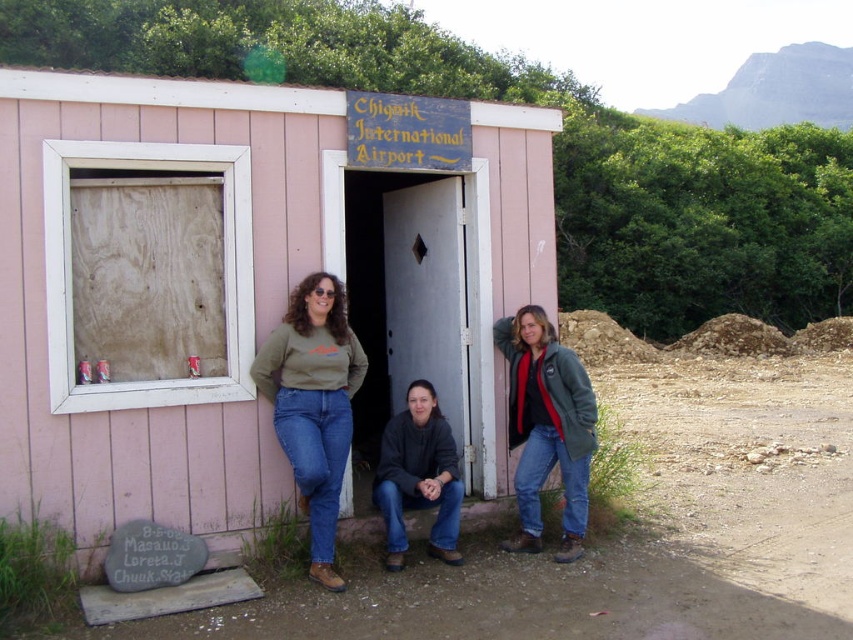
You are a photographer trying to capture a group photo of the matte green sweater at center and the green fleece jacket at right. Since you want them to be side by side, which one should you place on the left to match their current positions?

The matte green sweater at center should be placed on the left side of the green fleece jacket at right to match their current positions, as the matte green sweater at center is positioned on the left side of green fleece jacket at right.